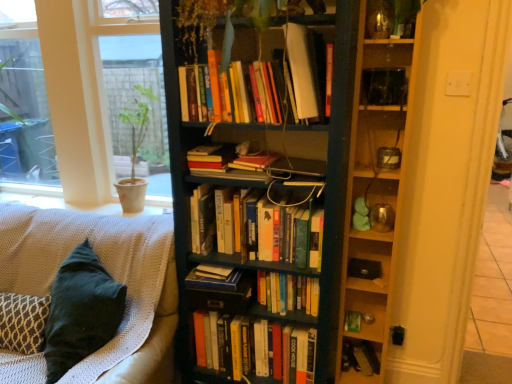
Question: Considering the positions of hardcover book at lower right, positioned as the 8th book in top-to-bottom order, and hardcover books at center, which is counted as the 1th book, starting from the top, in the image, is hardcover book at lower right, positioned as the 8th book in top-to-bottom order, taller or shorter than hardcover books at center, which is counted as the 1th book, starting from the top,?

Choices:
 (A) tall
 (B) short

Answer: (B)

Question: Based on their sizes in the image, would you say hardcover book at lower right, positioned as the 8th book in top-to-bottom order, is bigger or smaller than hardcover books at center, which is counted as the 1th book, starting from the top?

Choices:
 (A) big
 (B) small

Answer: (B)

Question: Considering the real-world distances, which object is farthest from the green matte paperback book at lower right?

Choices:
 (A) wooden shelves at right
 (B) hardcover books at center, acting as the 2th book starting from the top
 (C) dark wood bookcase at center
 (D) hardcover books at center, the 8th book ordered from the bottom
 (E) hardcover books at center, which ranks as the 2th book in bottom-to-top order

Answer: (D)

Question: Which object is the closest to the green matte paperback book at lower right?

Choices:
 (A) dark wood bookcase at center
 (B) hardcover books at center, arranged as the fourth book when ordered from the bottom
 (C) wooden shelves at right
 (D) velvet teal pillow at lower left
 (E) hardcover books at center, arranged as the 7th book when ordered from the bottom

Answer: (B)